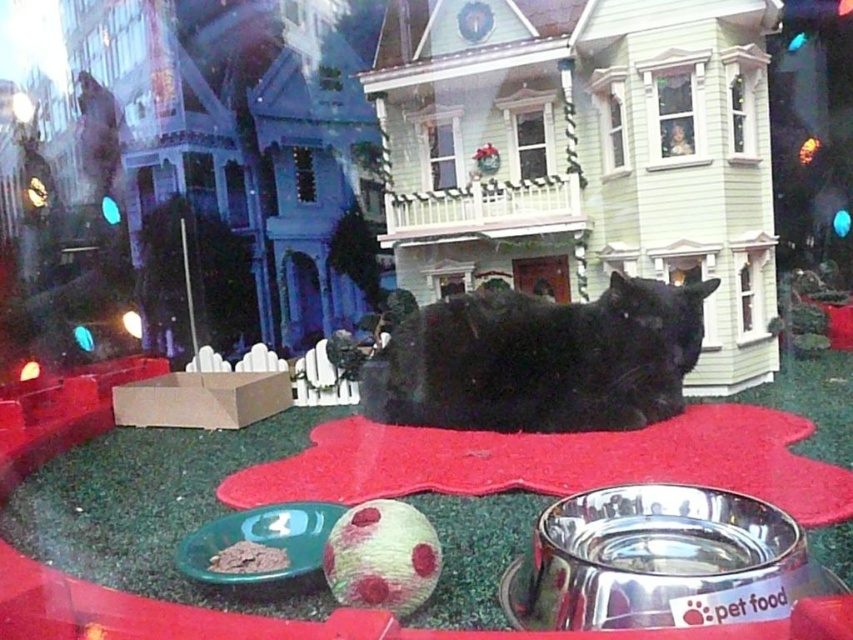
Question: Which object appears farthest from the camera in this image?

Choices:
 (A) brown crumbly pet food at lower center
 (B) black fur cat at center
 (C) red plush mat at center
 (D) clear glass window at upper center

Answer: (D)

Question: Which point appears farthest from the camera in this image?

Choices:
 (A) (614, 321)
 (B) (341, 556)

Answer: (A)

Question: Is red plush mat at center bigger than polka-dotted fabric ball at center?

Choices:
 (A) yes
 (B) no

Answer: (A)

Question: Which point is closer to the camera taking this photo?

Choices:
 (A) (383, 593)
 (B) (221, 554)
 (C) (659, 70)

Answer: (A)

Question: Does red plush mat at center have a greater width compared to clear glass window at upper center?

Choices:
 (A) no
 (B) yes

Answer: (B)

Question: Does polka-dotted fabric ball at center appear on the left side of clear glass window at upper center?

Choices:
 (A) no
 (B) yes

Answer: (B)